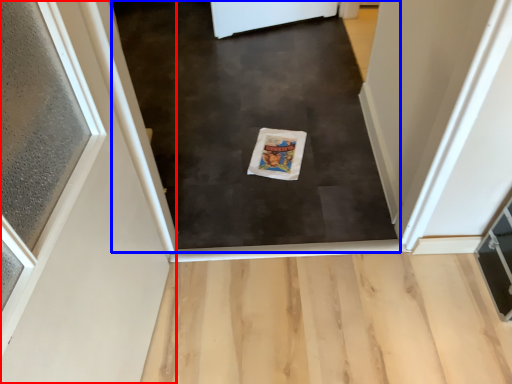
Question: Which of the following is the farthest to the observer, door (highlighted by a red box) or mat (highlighted by a blue box)?

Choices:
 (A) door
 (B) mat

Answer: (B)